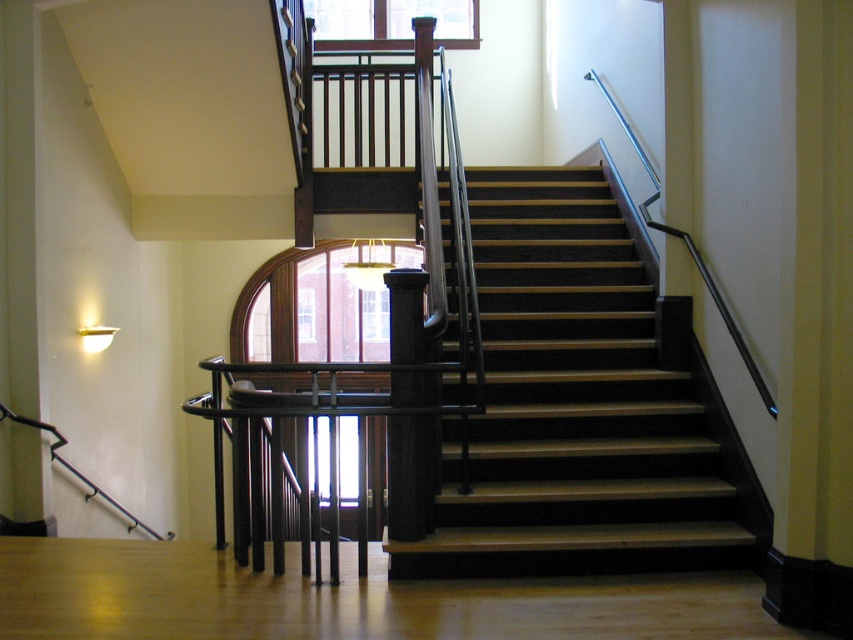
Question: Among these objects, which one is farthest from the camera?

Choices:
 (A) black polished wood pillar at center
 (B) wooden stairs at center

Answer: (B)

Question: Does wooden stairs at center appear on the left side of black polished wood pillar at center?

Choices:
 (A) no
 (B) yes

Answer: (A)

Question: Considering the relative positions of wooden stairs at center and black polished wood pillar at center in the image provided, where is wooden stairs at center located with respect to black polished wood pillar at center?

Choices:
 (A) right
 (B) left

Answer: (A)

Question: Which point is farther from the camera taking this photo?

Choices:
 (A) (386, 276)
 (B) (529, 388)

Answer: (B)

Question: Does wooden stairs at center have a smaller size compared to black polished wood pillar at center?

Choices:
 (A) yes
 (B) no

Answer: (B)